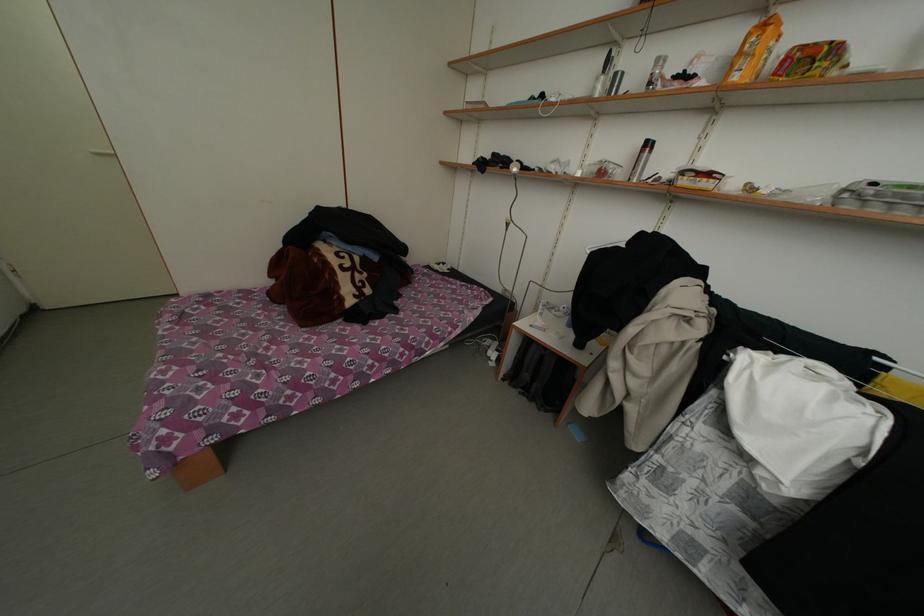
Where would you lift the silver metal cup? Please return your answer as a coordinate pair (x, y).

(608, 84)